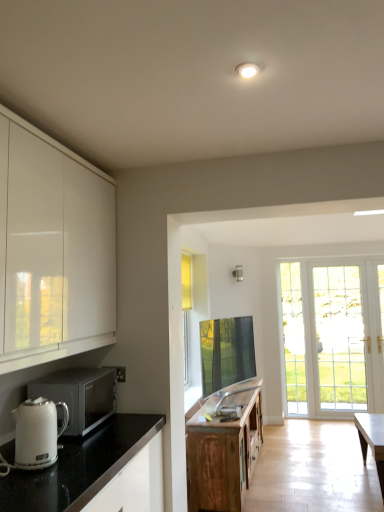
Image resolution: width=384 pixels, height=512 pixels. In order to click on wooden cabinet at center in this screenshot , I will do `click(223, 451)`.

Where is `white glossy countertop at lower left`? This screenshot has width=384, height=512. white glossy countertop at lower left is located at coordinates (80, 466).

Considering the sizes of objects wooden cabinet at center and silver metallic microwave at left in the image provided, who is wider, wooden cabinet at center or silver metallic microwave at left?

With larger width is wooden cabinet at center.

From the image's perspective, is wooden cabinet at center over silver metallic microwave at left?

No, from the image's perspective, wooden cabinet at center is not on top of silver metallic microwave at left.

Which of these two, wooden cabinet at center or silver metallic microwave at left, stands taller?

Standing taller between the two is wooden cabinet at center.

Is silver metallic microwave at left surrounded by wooden cabinet at center?

That's incorrect, silver metallic microwave at left is not inside wooden cabinet at center.

There is a wooden cabinet at center. At what (x,y) coordinates should I click in order to perform the action: click on countertop above it (from a real-world perspective). Please return your answer as a coordinate pair (x, y). The height and width of the screenshot is (512, 384). Looking at the image, I should click on (80, 466).

Is wooden cabinet at center aimed at white glossy countertop at lower left?

No, wooden cabinet at center is not turned towards white glossy countertop at lower left.

Is wooden cabinet at center with white glossy countertop at lower left?

No, wooden cabinet at center is not with white glossy countertop at lower left.

In the scene shown: Is white glossy electric kettle at lower left taller than wooden cabinet at center?

No.

Are white glossy electric kettle at lower left and wooden cabinet at center beside each other?

No, white glossy electric kettle at lower left is not touching wooden cabinet at center.

From a real-world perspective, does white glossy electric kettle at lower left stand above wooden cabinet at center?

Yes, from a real-world perspective, white glossy electric kettle at lower left is above wooden cabinet at center.

How distant is white glossy countertop at lower left from silver metallic microwave at left?

A distance of 8.96 inches exists between white glossy countertop at lower left and silver metallic microwave at left.

You are a GUI agent. You are given a task and a screenshot of the screen. Output one action in this format:
    pyautogui.click(x=<x>, y=<y>)
    Task: Click on the microwave oven behind the white glossy countertop at lower left
    The height and width of the screenshot is (512, 384).
    Given the screenshot: What is the action you would take?
    pyautogui.click(x=79, y=395)

Can silver metallic microwave at left be found inside white glossy countertop at lower left?

No.

Considering the relative sizes of white glossy countertop at lower left and silver metallic microwave at left in the image provided, is white glossy countertop at lower left smaller than silver metallic microwave at left?

No.

In terms of width, does silver metallic microwave at left look wider or thinner when compared to white glossy electric kettle at lower left?

In the image, silver metallic microwave at left appears to be wider than white glossy electric kettle at lower left.

Is silver metallic microwave at left in front of or behind white glossy electric kettle at lower left in the image?

silver metallic microwave at left is positioned farther from the viewer than white glossy electric kettle at lower left.

Considering the positions of point (91, 389) and point (16, 409), is point (91, 389) closer or farther from the camera than point (16, 409)?

Point (91, 389) is positioned farther from the camera compared to point (16, 409).

From a real-world perspective, which object stands above the other?

white glossy electric kettle at lower left, from a real-world perspective.

Can you tell me how much white glossy electric kettle at lower left and silver metallic microwave at left differ in facing direction?

0.658 degrees separate the facing orientations of white glossy electric kettle at lower left and silver metallic microwave at left.

Could you tell me if white glossy electric kettle at lower left is turned towards silver metallic microwave at left?

No, white glossy electric kettle at lower left is not oriented towards silver metallic microwave at left.

From a real-world perspective, between white glossy electric kettle at lower left and silver metallic microwave at left, who is vertically lower?

silver metallic microwave at left is physically lower.

Considering the relative sizes of white glossy electric kettle at lower left and silver metallic microwave at left in the image provided, is white glossy electric kettle at lower left taller than silver metallic microwave at left?

No.

Is white glossy electric kettle at lower left a part of wooden cabinet at center?

Actually, white glossy electric kettle at lower left is outside wooden cabinet at center.

Between wooden cabinet at center and white glossy electric kettle at lower left, which one is positioned behind?

wooden cabinet at center is behind.

Which object is thinner, wooden cabinet at center or white glossy electric kettle at lower left?

white glossy electric kettle at lower left.

Is there a large distance between wooden cabinet at center and white glossy electric kettle at lower left?

That's right, there is a large distance between wooden cabinet at center and white glossy electric kettle at lower left.

This screenshot has width=384, height=512. Identify the location of microwave oven lying in front of the wooden cabinet at center. (79, 395).

Locate an element on the screen. The image size is (384, 512). cabinetry below the white glossy countertop at lower left (from a real-world perspective) is located at coordinates (223, 451).

Which object lies further to the anchor point wooden cabinet at center, silver metallic microwave at left or white glossy electric kettle at lower left?

The object further to wooden cabinet at center is white glossy electric kettle at lower left.

Which object lies nearer to the anchor point silver metallic microwave at left, white glossy electric kettle at lower left or wooden cabinet at center?

The object closer to silver metallic microwave at left is white glossy electric kettle at lower left.

Based on their spatial positions, is wooden cabinet at center or white glossy electric kettle at lower left closer to silver metallic microwave at left?

white glossy electric kettle at lower left lies closer to silver metallic microwave at left than the other object.

Based on their spatial positions, is white glossy countertop at lower left or wooden cabinet at center further from white glossy electric kettle at lower left?

Based on the image, wooden cabinet at center appears to be further to white glossy electric kettle at lower left.

Looking at the image, which one is located closer to silver metallic microwave at left, white glossy countertop at lower left or wooden cabinet at center?

The object closer to silver metallic microwave at left is white glossy countertop at lower left.

Estimate the real-world distances between objects in this image. Which object is closer to white glossy countertop at lower left, white glossy electric kettle at lower left or silver metallic microwave at left?

white glossy electric kettle at lower left lies closer to white glossy countertop at lower left than the other object.

Looking at the image, which one is located further to white glossy electric kettle at lower left, wooden cabinet at center or white glossy countertop at lower left?

Based on the image, wooden cabinet at center appears to be further to white glossy electric kettle at lower left.

When comparing their distances from silver metallic microwave at left, does white glossy electric kettle at lower left or white glossy countertop at lower left seem further?

Based on the image, white glossy electric kettle at lower left appears to be further to silver metallic microwave at left.

Where is `microwave oven between white glossy electric kettle at lower left and wooden cabinet at center from front to back`? Image resolution: width=384 pixels, height=512 pixels. microwave oven between white glossy electric kettle at lower left and wooden cabinet at center from front to back is located at coordinates (79, 395).

This screenshot has width=384, height=512. What are the coordinates of `kitchen appliance between white glossy countertop at lower left and silver metallic microwave at left from front to back` in the screenshot? It's located at (37, 433).

Where is `microwave oven between white glossy countertop at lower left and wooden cabinet at center in the front-back direction`? microwave oven between white glossy countertop at lower left and wooden cabinet at center in the front-back direction is located at coordinates 79,395.

Where is `kitchen appliance between white glossy countertop at lower left and wooden cabinet at center in the front-back direction`? kitchen appliance between white glossy countertop at lower left and wooden cabinet at center in the front-back direction is located at coordinates (37, 433).